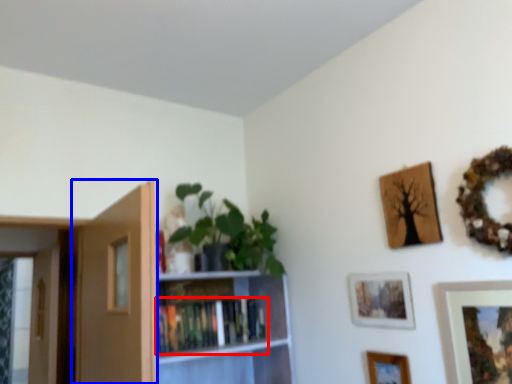
Question: Among these objects, which one is farthest to the camera, book (highlighted by a red box) or door (highlighted by a blue box)?

Choices:
 (A) book
 (B) door

Answer: (A)